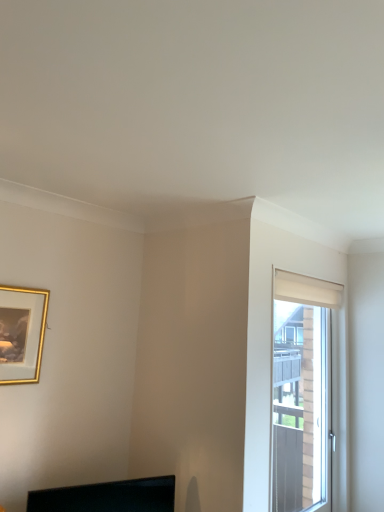
Question: From a real-world perspective, is black glossy monitor at lower center above or below white matte window at right?

Choices:
 (A) below
 (B) above

Answer: (A)

Question: Is black glossy monitor at lower center in front of or behind white matte window at right in the image?

Choices:
 (A) behind
 (B) front

Answer: (B)

Question: Which object is positioned farthest from the white matte window at right?

Choices:
 (A) black glossy monitor at lower center
 (B) gold-framed picture at upper left

Answer: (B)

Question: Which object is the farthest from the black glossy monitor at lower center?

Choices:
 (A) gold-framed picture at upper left
 (B) white matte window at right

Answer: (B)